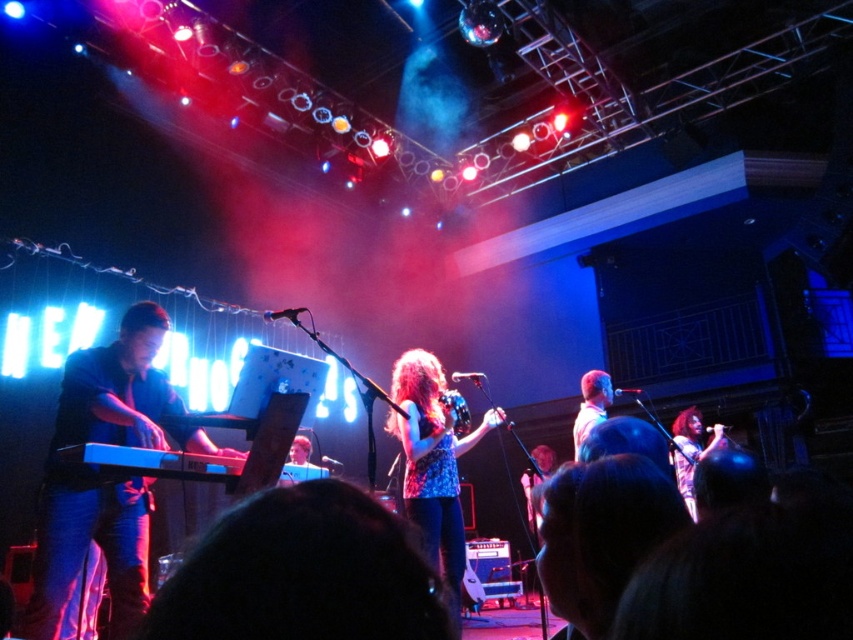
Does blue denim jeans at left have a greater height compared to light brown hair at center?

Indeed, blue denim jeans at left has a greater height compared to light brown hair at center.

Locate an element on the screen. The height and width of the screenshot is (640, 853). blue denim jeans at left is located at coordinates (105, 476).

Identify the location of blue denim jeans at left. This screenshot has width=853, height=640. (105, 476).

Identify the location of blue denim jeans at left. Image resolution: width=853 pixels, height=640 pixels. (105, 476).

Between floral-patterned dress at center and floral dress at center, which one appears on the left side from the viewer's perspective?

floral dress at center

Where is `floral-patterned dress at center`? floral-patterned dress at center is located at coordinates (692, 451).

At what (x,y) coordinates should I click in order to perform the action: click on floral-patterned dress at center. Please return your answer as a coordinate pair (x, y). Looking at the image, I should click on (692, 451).

Is blue denim jeans at left shorter than blue denim jeans at center?

No, blue denim jeans at left is not shorter than blue denim jeans at center.

Is blue denim jeans at left further to camera compared to blue denim jeans at center?

No.

Identify the location of blue denim jeans at left. (105, 476).